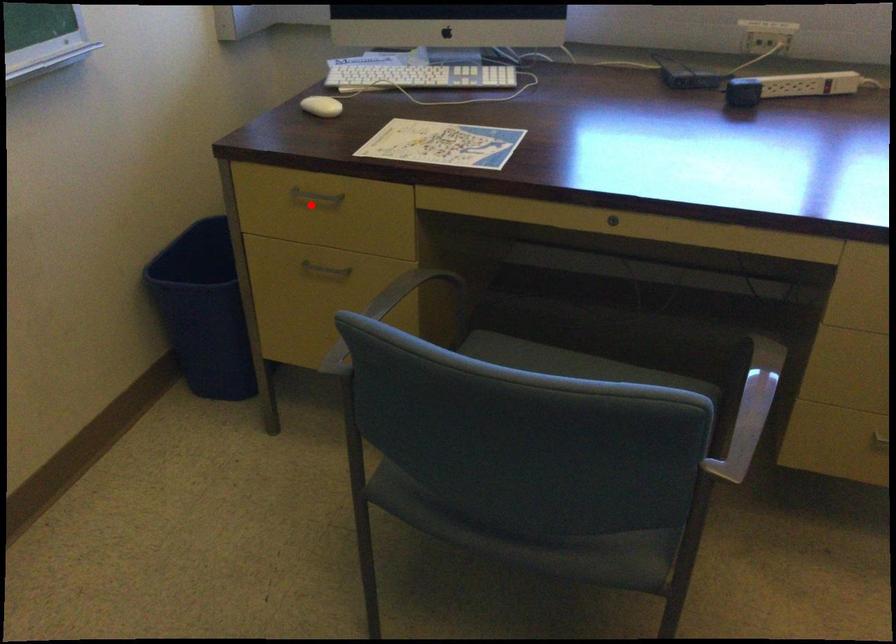
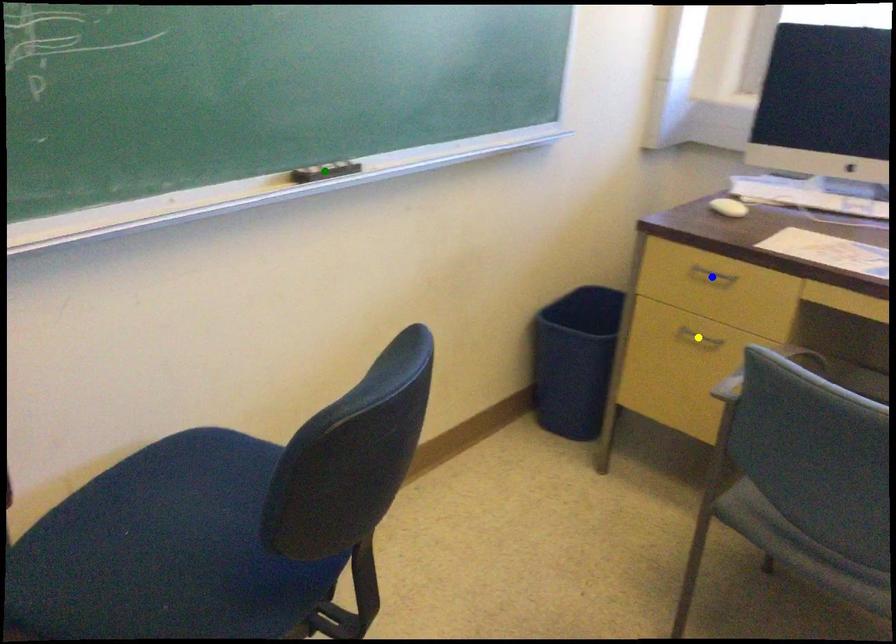
Question: I am providing you with two images of the same scene from different viewpoints. A red point is marked on the first image. You are given multiple points on the second image. Which point in image 2 represents the same 3d spot as the red point in image 1?

Choices:
 (A) blue point
 (B) green point
 (C) yellow point

Answer: (A)